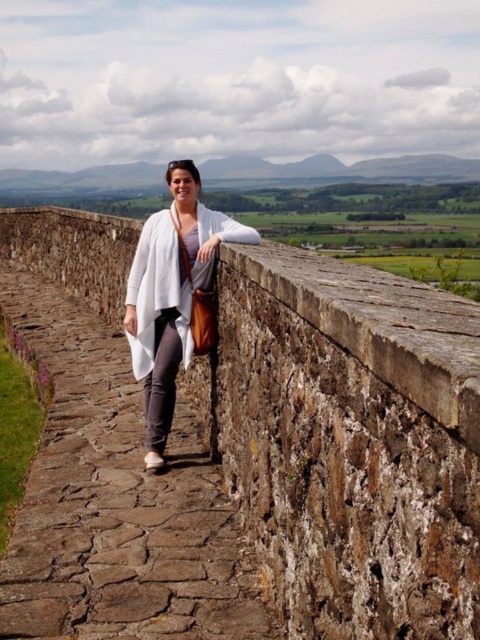
Question: Is brown stone wall at center positioned at the back of white matte cardigan at center?

Choices:
 (A) yes
 (B) no

Answer: (B)

Question: Among these points, which one is nearest to the camera?

Choices:
 (A) (160, 253)
 (B) (84, 243)

Answer: (A)

Question: Does brown stone wall at center have a smaller size compared to white matte cardigan at center?

Choices:
 (A) no
 (B) yes

Answer: (A)

Question: In this image, where is brown stone wall at center located relative to white matte cardigan at center?

Choices:
 (A) above
 (B) below

Answer: (A)

Question: Which point is farther to the camera?

Choices:
 (A) brown stone wall at center
 (B) white matte cardigan at center

Answer: (B)

Question: Which object appears closest to the camera in this image?

Choices:
 (A) white matte cardigan at center
 (B) brown stone wall at center

Answer: (B)